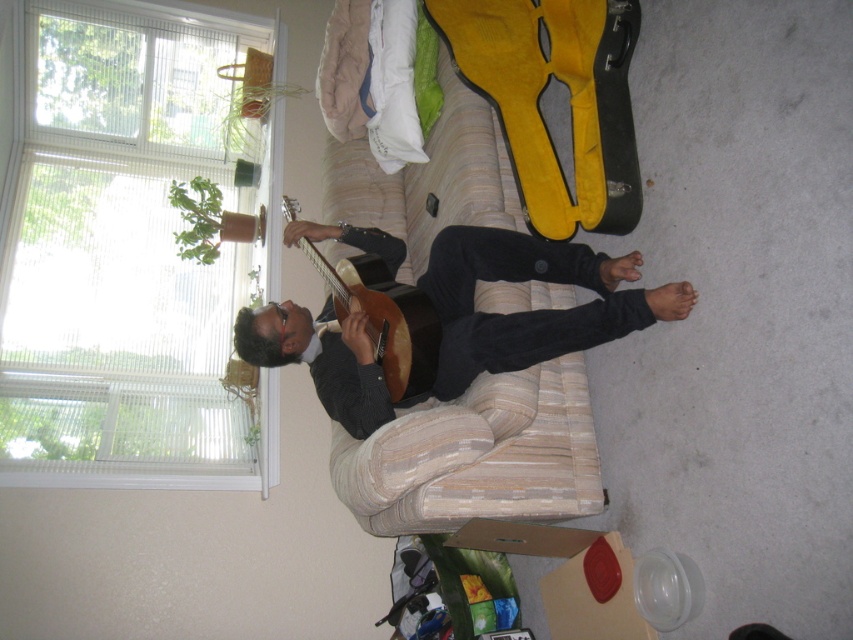
You are an interior designer planning to place a new sofa in the living room. The current sofa is the yellow fabric bed at center. Where should you place the new sofa to maintain symmetry with the existing one?

The yellow fabric bed at center is located at point (477, 456) in the room. To maintain symmetry, the new sofa should be placed at the mirror image coordinates, which would be point (477, 182).

You are a delivery person standing at the entrance of the room. You need to place a package that is 3 feet long on the yellow fabric bed at center. Can you fit the package on the bed without it hanging over the edge?

The distance between the yellow fabric bed at center and the viewer is 7.43 feet. Since the package is only 3 feet long, it will fit on the bed without hanging over the edge as there is sufficient space.

From the picture: You are a musician who needs to choose a guitar to play. Both the matte brown guitar at center and the wooden acoustic guitar at center are available. Which one is shorter?

The matte brown guitar at center is shorter than the wooden acoustic guitar at center.